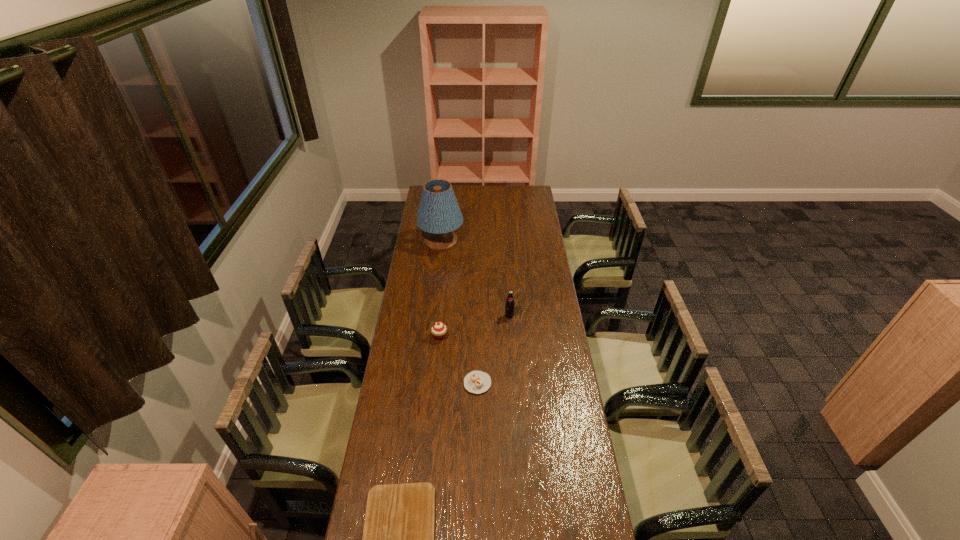
Image resolution: width=960 pixels, height=540 pixels. I want to click on unoccupied position between the farthest object and the right cupcake, so click(460, 312).

Identify which object is the fourth nearest to the lampshade. Please provide its 2D coordinates. Your answer should be formatted as a tuple, i.e. [(x, y)], where the tuple contains the x and y coordinates of a point satisfying the conditions above.

[(398, 537)]

Point out which object is positioned as the fourth nearest to the lampshade. Please provide its 2D coordinates. Your answer should be formatted as a tuple, i.e. [(x, y)], where the tuple contains the x and y coordinates of a point satisfying the conditions above.

[(398, 537)]